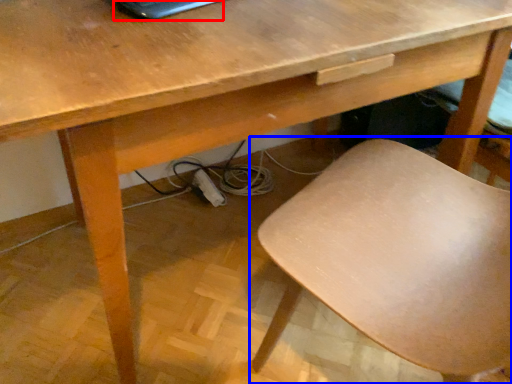
Question: Which of the following is the closest to the observer, laptop (highlighted by a red box) or chair (highlighted by a blue box)?

Choices:
 (A) laptop
 (B) chair

Answer: (B)